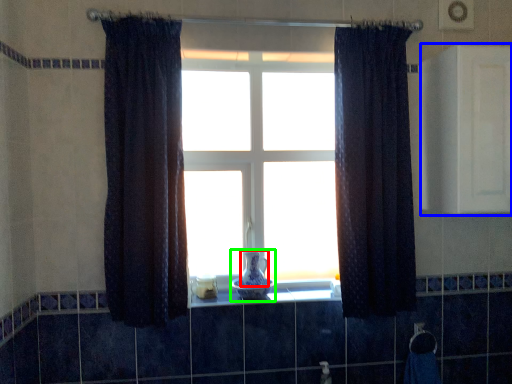
Question: Considering the real-world distances, which object is farthest from glass vase (highlighted by a red box)? medicine cabinet (highlighted by a blue box) or glass vase (highlighted by a green box)?

Choices:
 (A) medicine cabinet
 (B) glass vase

Answer: (A)